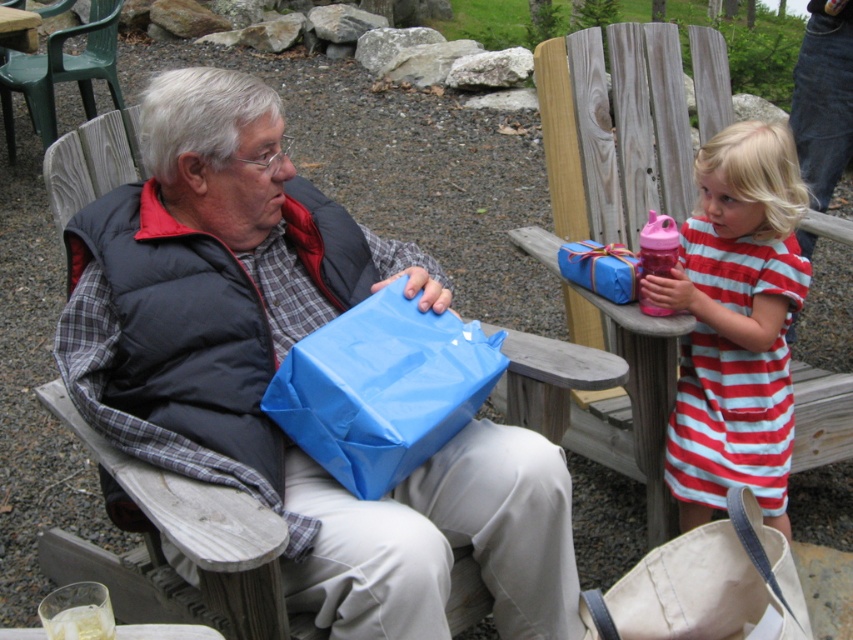
Who is more distant from viewer, (268, 451) or (50, 52)?

The point (50, 52) is more distant.

This screenshot has height=640, width=853. I want to click on blue matte gift bag at center, so click(x=277, y=365).

Where is `blue matte gift bag at center`? blue matte gift bag at center is located at coordinates (277, 365).

Can you confirm if blue matte gift bag at center is wider than wooden chair at upper center?

Yes, blue matte gift bag at center is wider than wooden chair at upper center.

Can you confirm if blue matte gift bag at center is positioned to the right of wooden chair at upper center?

No, blue matte gift bag at center is not to the right of wooden chair at upper center.

I want to click on blue matte gift bag at center, so click(277, 365).

In the scene shown: Who is positioned more to the left, wooden chair at upper center or canvas tote bag at lower right?

canvas tote bag at lower right

The image size is (853, 640). What do you see at coordinates (614, 132) in the screenshot?
I see `wooden chair at upper center` at bounding box center [614, 132].

Who is more forward, (577,157) or (659,580)?

Positioned in front is point (659,580).

Where is `wooden chair at upper center`? Image resolution: width=853 pixels, height=640 pixels. wooden chair at upper center is located at coordinates (614, 132).